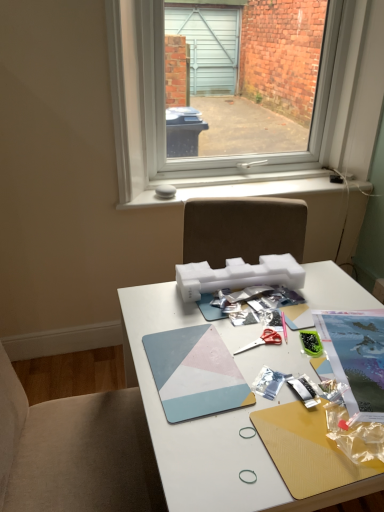
You are a GUI agent. You are given a task and a screenshot of the screen. Output one action in this format:
    pyautogui.click(x=<x>, y=<y>)
    Task: Click on the transparent glass window at upper center
    
    Given the screenshot: What is the action you would take?
    pyautogui.click(x=209, y=129)

From the picture: Measure the distance between point (312, 339) and camera.

Point (312, 339) is 1.13 meters away from camera.

The height and width of the screenshot is (512, 384). What do you see at coordinates (262, 340) in the screenshot?
I see `red plastic scissors at center` at bounding box center [262, 340].

Measure the distance between red plastic scissors at center and camera.

The depth of red plastic scissors at center is 3.53 feet.

Measure the distance between point [192,338] and camera.

Point [192,338] is 1.12 meters from camera.

Find the location of a particular element. The image size is (384, 512). geometric matte mousepad at center, positioned as the first magazine in left-to-right order is located at coordinates (195, 373).

The image size is (384, 512). Describe the element at coordinates (356, 358) in the screenshot. I see `printed paper magazine at center right, the first magazine positioned from the right` at that location.

I want to click on transparent glass window at upper center, so click(x=209, y=129).

Can you confirm if red plastic scissors at center is wider than green plastic container at center-right?

Yes, red plastic scissors at center is wider than green plastic container at center-right.

Between red plastic scissors at center and green plastic container at center-right, which one appears on the right side from the viewer's perspective?

From the viewer's perspective, green plastic container at center-right appears more on the right side.

Considering the sizes of objects red plastic scissors at center and green plastic container at center-right in the image provided, who is shorter, red plastic scissors at center or green plastic container at center-right?

red plastic scissors at center.

From a real-world perspective, is red plastic scissors at center below green plastic container at center-right?

Yes, from a real-world perspective, red plastic scissors at center is beneath green plastic container at center-right.

Consider the image. Is geometric matte mousepad at center, acting as the 2th magazine starting from the right, behind white matte desk at center?

That is True.

Based on the photo, would you say geometric matte mousepad at center, acting as the 2th magazine starting from the right, is to the left or to the right of white matte desk at center in the picture?

geometric matte mousepad at center, acting as the 2th magazine starting from the right, is to the left of white matte desk at center.

From the image's perspective, which is below, geometric matte mousepad at center, acting as the 2th magazine starting from the right, or white matte desk at center?

white matte desk at center is shown below in the image.

Considering the points (214, 401) and (226, 425), which point is in front, point (214, 401) or point (226, 425)?

Point (226, 425)

Is geometric matte mousepad at center, acting as the 2th magazine starting from the right, further to camera compared to transparent glass window at upper center?

No, the depth of geometric matte mousepad at center, acting as the 2th magazine starting from the right, is less than that of transparent glass window at upper center.

From their relative heights in the image, would you say geometric matte mousepad at center, positioned as the first magazine in left-to-right order, is taller or shorter than transparent glass window at upper center?

Clearly, geometric matte mousepad at center, positioned as the first magazine in left-to-right order, is shorter compared to transparent glass window at upper center.

Is geometric matte mousepad at center, positioned as the first magazine in left-to-right order, located outside transparent glass window at upper center?

geometric matte mousepad at center, positioned as the first magazine in left-to-right order, lies outside transparent glass window at upper center's area.

Which object is wider, geometric matte mousepad at center, acting as the 2th magazine starting from the right, or transparent glass window at upper center?

geometric matte mousepad at center, acting as the 2th magazine starting from the right, is wider.

Is point (278, 337) less distant than point (190, 372)?

No, it is behind (190, 372).

Is red plastic scissors at center to the left of geometric matte mousepad at center, acting as the 2th magazine starting from the right, from the viewer's perspective?

In fact, red plastic scissors at center is to the right of geometric matte mousepad at center, acting as the 2th magazine starting from the right.

Who is bigger, red plastic scissors at center or geometric matte mousepad at center, acting as the 2th magazine starting from the right?

geometric matte mousepad at center, acting as the 2th magazine starting from the right.

How far apart are red plastic scissors at center and geometric matte mousepad at center, positioned as the first magazine in left-to-right order?

red plastic scissors at center and geometric matte mousepad at center, positioned as the first magazine in left-to-right order, are 5.90 inches apart from each other.

From a real-world perspective, is transparent glass window at upper center over geometric matte mousepad at center, acting as the 2th magazine starting from the right?

Correct, in the physical world, transparent glass window at upper center is higher than geometric matte mousepad at center, acting as the 2th magazine starting from the right.

Can you confirm if transparent glass window at upper center is bigger than geometric matte mousepad at center, acting as the 2th magazine starting from the right?

Yes, transparent glass window at upper center is bigger than geometric matte mousepad at center, acting as the 2th magazine starting from the right.

Is transparent glass window at upper center turned away from geometric matte mousepad at center, acting as the 2th magazine starting from the right?

No, transparent glass window at upper center's orientation is not away from geometric matte mousepad at center, acting as the 2th magazine starting from the right.

Is geometric matte mousepad at center, positioned as the first magazine in left-to-right order, completely or partially inside green plastic container at center-right?

No, geometric matte mousepad at center, positioned as the first magazine in left-to-right order, is not surrounded by green plastic container at center-right.

Considering the sizes of objects green plastic container at center-right and geometric matte mousepad at center, positioned as the first magazine in left-to-right order, in the image provided, who is wider, green plastic container at center-right or geometric matte mousepad at center, positioned as the first magazine in left-to-right order,?

geometric matte mousepad at center, positioned as the first magazine in left-to-right order.

From a real-world perspective, is green plastic container at center-right positioned above or below geometric matte mousepad at center, acting as the 2th magazine starting from the right?

Clearly, from a real-world perspective, green plastic container at center-right is above geometric matte mousepad at center, acting as the 2th magazine starting from the right.

Which object is closer to the camera, green plastic container at center-right or geometric matte mousepad at center, positioned as the first magazine in left-to-right order?

geometric matte mousepad at center, positioned as the first magazine in left-to-right order, is closer to the camera.

Does green plastic container at center-right touch white matte desk at center?

green plastic container at center-right is not next to white matte desk at center, and they're not touching.

Between green plastic container at center-right and white matte desk at center, which one has less height?

green plastic container at center-right is shorter.

Would you say green plastic container at center-right is outside white matte desk at center?

No, green plastic container at center-right is inside white matte desk at center's boundary.

Locate an element on the screen. stationery behind the red plastic scissors at center is located at coordinates click(x=311, y=342).

Where is `the 2nd magazine located above the white matte desk at center (from a real-world perspective)`? This screenshot has width=384, height=512. the 2nd magazine located above the white matte desk at center (from a real-world perspective) is located at coordinates (195, 373).

Based on their spatial positions, is red plastic scissors at center or printed paper magazine at center right, the second magazine when ordered from left to right, further from white matte desk at center?

Based on the image, red plastic scissors at center appears to be further to white matte desk at center.

Considering their positions, is red plastic scissors at center positioned further to printed paper magazine at center right, the first magazine positioned from the right, than white matte desk at center?

red plastic scissors at center lies further to printed paper magazine at center right, the first magazine positioned from the right, than the other object.

Estimate the real-world distances between objects in this image. Which object is further from green plastic container at center-right, red plastic scissors at center or transparent glass window at upper center?

transparent glass window at upper center is further to green plastic container at center-right.

Based on their spatial positions, is white matte desk at center or printed paper magazine at center right, the first magazine positioned from the right, closer to geometric matte mousepad at center, positioned as the first magazine in left-to-right order?

white matte desk at center is positioned closer to the anchor geometric matte mousepad at center, positioned as the first magazine in left-to-right order.

Estimate the real-world distances between objects in this image. Which object is closer to red plastic scissors at center, white matte desk at center or transparent glass window at upper center?

The object closer to red plastic scissors at center is white matte desk at center.

Consider the image. Looking at the image, which one is located closer to white matte desk at center, transparent glass window at upper center or geometric matte mousepad at center, acting as the 2th magazine starting from the right?

Based on the image, geometric matte mousepad at center, acting as the 2th magazine starting from the right, appears to be nearer to white matte desk at center.

Estimate the real-world distances between objects in this image. Which object is further from transparent glass window at upper center, green plastic container at center-right or white matte desk at center?

green plastic container at center-right is positioned further to the anchor transparent glass window at upper center.

Considering their positions, is transparent glass window at upper center positioned closer to geometric matte mousepad at center, acting as the 2th magazine starting from the right, than white matte desk at center?

white matte desk at center lies closer to geometric matte mousepad at center, acting as the 2th magazine starting from the right, than the other object.

Find the location of a particular element. The height and width of the screenshot is (512, 384). scissors between transparent glass window at upper center and white matte desk at center from top to bottom is located at coordinates (262, 340).

Identify the location of stationery between red plastic scissors at center and printed paper magazine at center right, the first magazine positioned from the right. (311, 342).

I want to click on stationery between geometric matte mousepad at center, acting as the 2th magazine starting from the right, and printed paper magazine at center right, the first magazine positioned from the right, so click(x=311, y=342).

Find the location of a particular element. stationery between transparent glass window at upper center and printed paper magazine at center right, the second magazine when ordered from left to right, from top to bottom is located at coordinates (311, 342).